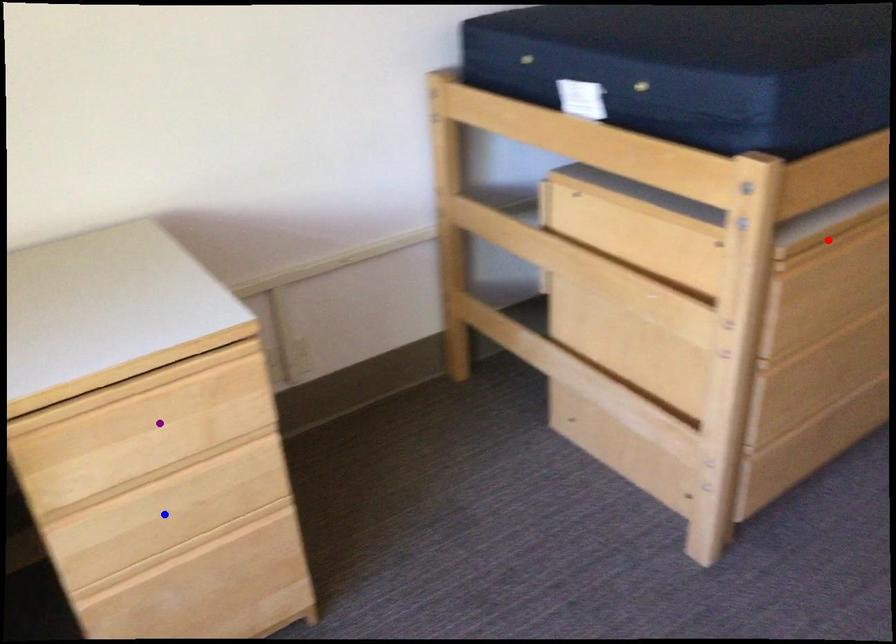
Order these from nearest to farthest:
purple point, blue point, red point

purple point, blue point, red point